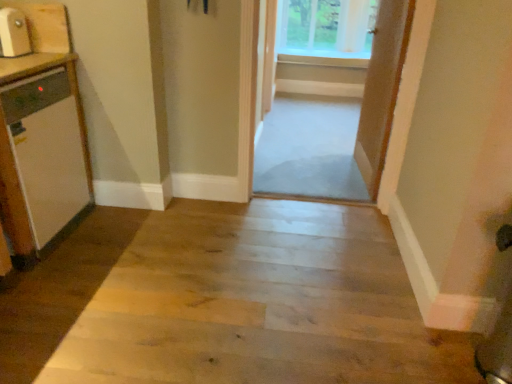
Question: Could you tell me if wooden floor at center is turned towards white glossy dishwasher at left, positioned as the 1th appliance in bottom-to-top order?

Choices:
 (A) no
 (B) yes

Answer: (A)

Question: Is wooden floor at center thinner than white glossy dishwasher at left, which is the second appliance from top to bottom?

Choices:
 (A) yes
 (B) no

Answer: (B)

Question: From the image's perspective, does wooden floor at center appear higher than white glossy dishwasher at left, which is the second appliance from top to bottom?

Choices:
 (A) no
 (B) yes

Answer: (A)

Question: Is white glossy dishwasher at left, positioned as the 1th appliance in bottom-to-top order, surrounded by wooden floor at center?

Choices:
 (A) no
 (B) yes

Answer: (A)

Question: Considering the relative sizes of wooden floor at center and white glossy dishwasher at left, positioned as the 1th appliance in bottom-to-top order, in the image provided, is wooden floor at center shorter than white glossy dishwasher at left, positioned as the 1th appliance in bottom-to-top order,?

Choices:
 (A) no
 (B) yes

Answer: (B)

Question: From a real-world perspective, is clear glass window at upper center physically located above or below white glossy dishwasher at left, which is the second appliance from top to bottom?

Choices:
 (A) above
 (B) below

Answer: (A)

Question: Considering the positions of clear glass window at upper center and white glossy dishwasher at left, which is the second appliance from top to bottom, in the image, is clear glass window at upper center bigger or smaller than white glossy dishwasher at left, which is the second appliance from top to bottom,?

Choices:
 (A) small
 (B) big

Answer: (A)

Question: Is point (302, 51) closer or farther from the camera than point (13, 119)?

Choices:
 (A) farther
 (B) closer

Answer: (A)

Question: From their relative heights in the image, would you say clear glass window at upper center is taller or shorter than white glossy dishwasher at left, which is the second appliance from top to bottom?

Choices:
 (A) tall
 (B) short

Answer: (B)

Question: Considering the positions of wooden door at center, which is counted as the 2th door, starting from the right, and wooden door at center, arranged as the 1th door when viewed from the front, in the image, is wooden door at center, which is counted as the 2th door, starting from the right, bigger or smaller than wooden door at center, arranged as the 1th door when viewed from the front,?

Choices:
 (A) big
 (B) small

Answer: (A)

Question: From the image's perspective, is wooden door at center, which is counted as the 2th door, starting from the right, located above or below wooden door at center, the 1th door positioned from the right?

Choices:
 (A) above
 (B) below

Answer: (A)

Question: Visually, is wooden door at center, the second door positioned from the front, positioned to the left or to the right of wooden door at center, the 1th door positioned from the right?

Choices:
 (A) right
 (B) left

Answer: (B)

Question: Choose the correct answer: Is wooden door at center, which is the 1th door in left-to-right order, inside wooden door at center, which is counted as the second door, starting from the back, or outside it?

Choices:
 (A) inside
 (B) outside

Answer: (B)

Question: From a real-world perspective, is matte wood microwave at left, marked as the 1th appliance in a top-to-bottom arrangement, physically located above or below clear glass screen door at center?

Choices:
 (A) below
 (B) above

Answer: (B)

Question: Is point (7, 46) positioned closer to the camera than point (327, 129)?

Choices:
 (A) closer
 (B) farther

Answer: (A)